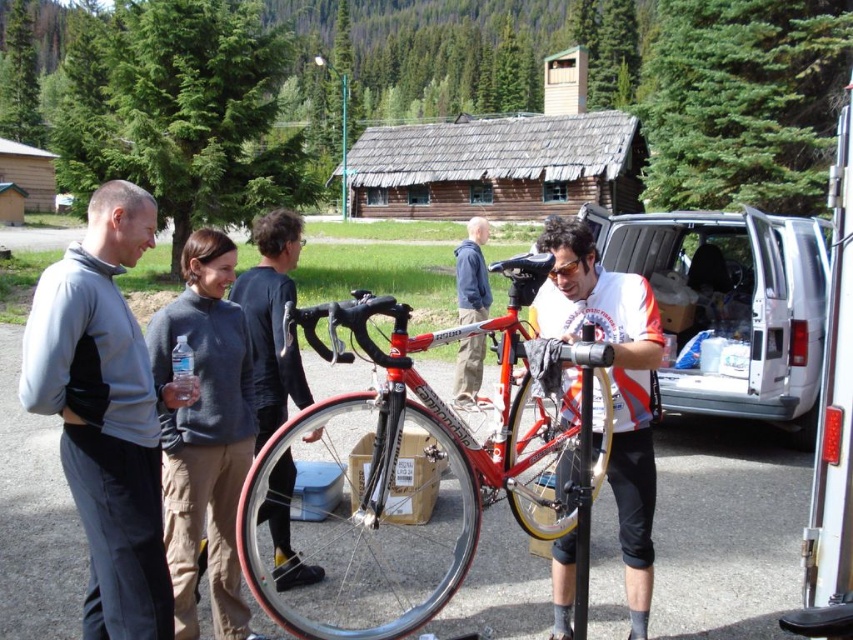
You are a delivery person who needs to park your white plastic van at right next to the shiny silver helmet at center. Given the space available, will the van fit without overlapping the helmet?

The white plastic van at right is narrower than the shiny silver helmet at center, so it can fit next to the helmet without overlapping.

Looking at this image, you are a hiker who wants to take the shiny silver helmet at center with you but need to pass by the white plastic van at right. Can you reach the helmet without moving the van?

The shiny silver helmet at center is behind the white plastic van at right, so you can reach it without moving the van because it is positioned behind it.